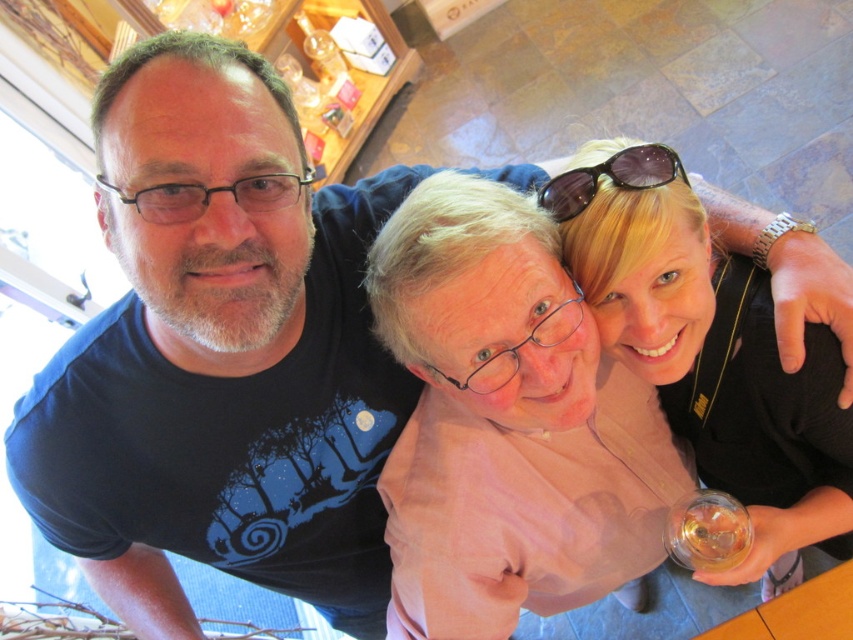
Question: Is blonde hair at upper right below black plastic glasses at upper left?

Choices:
 (A) no
 (B) yes

Answer: (B)

Question: Which of these objects is positioned farthest from the black plastic sunglasses at upper center?

Choices:
 (A) blonde hair at upper right
 (B) black plastic glasses at upper left

Answer: (B)

Question: Based on their relative distances, which object is farther from the black plastic glasses at upper left?

Choices:
 (A) blonde hair at upper right
 (B) black plastic sunglasses at upper center

Answer: (A)

Question: Is blonde hair at upper right smaller than black plastic sunglasses at upper center?

Choices:
 (A) yes
 (B) no

Answer: (B)

Question: From the image, what is the correct spatial relationship of blonde hair at upper right in relation to black plastic glasses at upper left?

Choices:
 (A) right
 (B) left

Answer: (A)

Question: Which is farther from the black plastic sunglasses at upper center?

Choices:
 (A) black plastic glasses at upper left
 (B) blonde hair at upper right

Answer: (A)